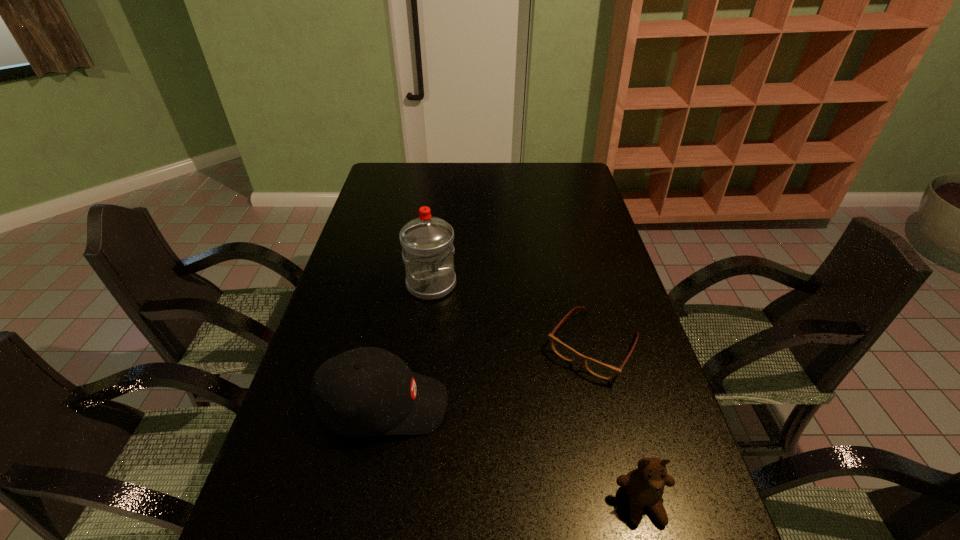
You are a GUI agent. You are given a task and a screenshot of the screen. Output one action in this format:
    pyautogui.click(x=<x>, y=<y>)
    Task: Click on the vacant area between the nearest object and the baseball cap
    
    Given the screenshot: What is the action you would take?
    pyautogui.click(x=514, y=455)

The image size is (960, 540). I want to click on unoccupied position between the nearest object and the baseball cap, so click(x=514, y=455).

The height and width of the screenshot is (540, 960). Identify the location of free spot between the farthest object and the baseball cap. (408, 345).

Identify which object is the nearest to the farthest object. Please provide its 2D coordinates. Your answer should be formatted as a tuple, i.e. [(x, y)], where the tuple contains the x and y coordinates of a point satisfying the conditions above.

[(604, 371)]

This screenshot has width=960, height=540. I want to click on object that ranks as the second closest to the shortest object, so click(x=366, y=391).